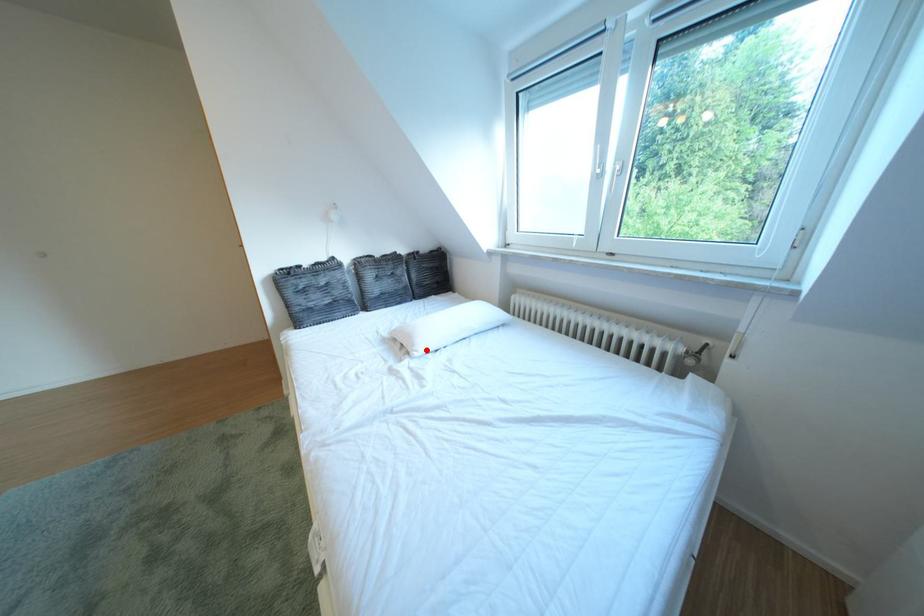
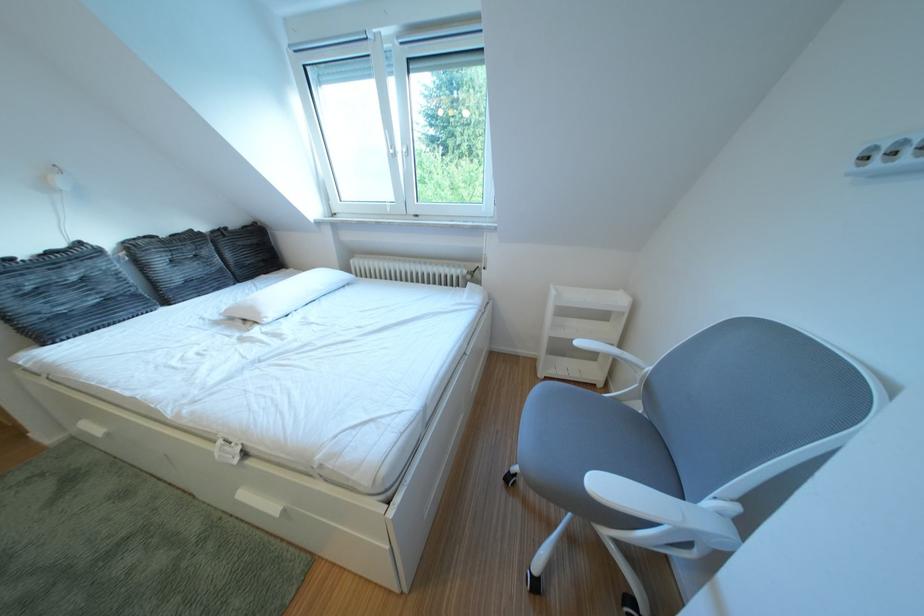
Locate, in the second image, the point that corresponds to the highlighted location in the first image.

(273, 318)